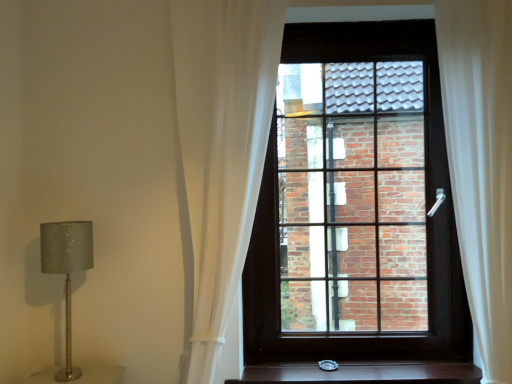
Describe the element at coordinates (222, 146) in the screenshot. I see `white sheer curtain at center, the 2th curtain in the right-to-left sequence` at that location.

The image size is (512, 384). What do you see at coordinates (481, 163) in the screenshot? I see `white sheer curtain at right, which is the 2th curtain from left to right` at bounding box center [481, 163].

Measure the distance between wooden stair treads at lower center and camera.

The distance of wooden stair treads at lower center from camera is 5.85 feet.

Where is `silver textured lamp at left`? silver textured lamp at left is located at coordinates (67, 270).

What do you see at coordinates (356, 204) in the screenshot?
I see `matte dark wood window at center` at bounding box center [356, 204].

Find the location of `white sheer curtain at center, the 2th curtain in the right-to-left sequence`. white sheer curtain at center, the 2th curtain in the right-to-left sequence is located at coordinates (222, 146).

From a real-world perspective, which is physically below, wooden stair treads at lower center or silver textured lamp at left?

From a 3D spatial view, wooden stair treads at lower center is below.

Can you confirm if wooden stair treads at lower center is smaller than silver textured lamp at left?

Yes, wooden stair treads at lower center is smaller than silver textured lamp at left.

Who is more distant, wooden stair treads at lower center or silver textured lamp at left?

wooden stair treads at lower center is further away from the camera.

Are wooden stair treads at lower center and matte dark wood window at center located far from each other?

No.

How many degrees apart are the facing directions of wooden stair treads at lower center and matte dark wood window at center?

The facing directions of wooden stair treads at lower center and matte dark wood window at center are 0.574 degrees apart.

Is wooden stair treads at lower center taller than matte dark wood window at center?

Answer: No.

From a real-world perspective, is wooden stair treads at lower center positioned over matte dark wood window at center based on gravity?

No, from a real-world perspective, wooden stair treads at lower center is not over matte dark wood window at center

Based on the photo, who is more distant, silver textured lamp at left or white sheer curtain at center, the 1th curtain when ordered from left to right?

white sheer curtain at center, the 1th curtain when ordered from left to right, is further away from the camera.

From a real-world perspective, is silver textured lamp at left on top of white sheer curtain at center, the 2th curtain in the right-to-left sequence?

No, from a real-world perspective, silver textured lamp at left is not above white sheer curtain at center, the 2th curtain in the right-to-left sequence.

Is point (75, 369) behind point (443, 257)?

That is False.

Are silver textured lamp at left and matte dark wood window at center beside each other?

They are not placed beside each other.

Does silver textured lamp at left have a larger size compared to matte dark wood window at center?

Actually, silver textured lamp at left might be smaller than matte dark wood window at center.

Based on the photo, in the image, is silver textured lamp at left positioned in front of or behind matte dark wood window at center?

Clearly, silver textured lamp at left is in front of matte dark wood window at center.

In the scene shown: From a real-world perspective, is white sheer curtain at center, the 1th curtain when ordered from left to right, physically located above or below wooden stair treads at lower center?

white sheer curtain at center, the 1th curtain when ordered from left to right, is above wooden stair treads at lower center.

Considering the positions of objects white sheer curtain at center, the 1th curtain when ordered from left to right, and wooden stair treads at lower center in the image provided, who is in front, white sheer curtain at center, the 1th curtain when ordered from left to right, or wooden stair treads at lower center?

white sheer curtain at center, the 1th curtain when ordered from left to right, is closer to the camera.

Looking at the image, does white sheer curtain at center, the 1th curtain when ordered from left to right, seem bigger or smaller compared to wooden stair treads at lower center?

Clearly, white sheer curtain at center, the 1th curtain when ordered from left to right, is larger in size than wooden stair treads at lower center.

How many degrees apart are the facing directions of white sheer curtain at center, the 2th curtain in the right-to-left sequence, and silver textured lamp at left?

The angular difference between white sheer curtain at center, the 2th curtain in the right-to-left sequence, and silver textured lamp at left is 89.1 degrees.

In the scene shown: Which point is more forward, (253, 39) or (50, 273)?

Point (253, 39)

Do you think white sheer curtain at center, the 1th curtain when ordered from left to right, is within silver textured lamp at left, or outside of it?

white sheer curtain at center, the 1th curtain when ordered from left to right, cannot be found inside silver textured lamp at left.

From the picture: Considering the relative positions of white sheer curtain at center, the 2th curtain in the right-to-left sequence, and silver textured lamp at left in the image provided, is white sheer curtain at center, the 2th curtain in the right-to-left sequence, to the left of silver textured lamp at left from the viewer's perspective?

No.

Does white sheer curtain at right, which is the 2th curtain from left to right, have a lesser width compared to wooden stair treads at lower center?

Result: Correct, the width of white sheer curtain at right, which is the 2th curtain from left to right, is less than that of wooden stair treads at lower center.

From a real-world perspective, count 1st curtains upward from the wooden stair treads at lower center and point to it. Please provide its 2D coordinates.

[(481, 163)]

Considering the relative sizes of white sheer curtain at right, which is the 2th curtain from left to right, and wooden stair treads at lower center in the image provided, is white sheer curtain at right, which is the 2th curtain from left to right, bigger than wooden stair treads at lower center?

Correct, white sheer curtain at right, which is the 2th curtain from left to right, is larger in size than wooden stair treads at lower center.

Is white sheer curtain at right, positioned as the first curtain in right-to-left order, oriented towards wooden stair treads at lower center?

No, white sheer curtain at right, positioned as the first curtain in right-to-left order, does not turn towards wooden stair treads at lower center.

This screenshot has width=512, height=384. I want to click on stairs below the silver textured lamp at left (from the image's perspective), so click(x=362, y=373).

Identify the location of stairs below the matte dark wood window at center (from a real-world perspective). (362, 373).

Looking at the image, which one is located further to white sheer curtain at center, the 1th curtain when ordered from left to right, white sheer curtain at right, positioned as the first curtain in right-to-left order, or wooden stair treads at lower center?

white sheer curtain at right, positioned as the first curtain in right-to-left order, lies further to white sheer curtain at center, the 1th curtain when ordered from left to right, than the other object.

Based on their spatial positions, is matte dark wood window at center or white sheer curtain at center, the 2th curtain in the right-to-left sequence, further from silver textured lamp at left?

matte dark wood window at center.

When comparing their distances from matte dark wood window at center, does white sheer curtain at right, positioned as the first curtain in right-to-left order, or white sheer curtain at center, the 2th curtain in the right-to-left sequence, seem closer?

Among the two, white sheer curtain at right, positioned as the first curtain in right-to-left order, is located nearer to matte dark wood window at center.

Considering their positions, is wooden stair treads at lower center positioned further to white sheer curtain at right, which is the 2th curtain from left to right, than white sheer curtain at center, the 2th curtain in the right-to-left sequence?

The object further to white sheer curtain at right, which is the 2th curtain from left to right, is white sheer curtain at center, the 2th curtain in the right-to-left sequence.

Based on their spatial positions, is white sheer curtain at center, the 2th curtain in the right-to-left sequence, or silver textured lamp at left closer to white sheer curtain at right, positioned as the first curtain in right-to-left order?

Based on the image, white sheer curtain at center, the 2th curtain in the right-to-left sequence, appears to be nearer to white sheer curtain at right, positioned as the first curtain in right-to-left order.

When comparing their distances from white sheer curtain at right, which is the 2th curtain from left to right, does white sheer curtain at center, the 1th curtain when ordered from left to right, or matte dark wood window at center seem closer?

matte dark wood window at center is positioned closer to the anchor white sheer curtain at right, which is the 2th curtain from left to right.

Considering their positions, is wooden stair treads at lower center positioned closer to silver textured lamp at left than white sheer curtain at right, which is the 2th curtain from left to right?

The object closer to silver textured lamp at left is wooden stair treads at lower center.

Which object lies further to the anchor point matte dark wood window at center, silver textured lamp at left or white sheer curtain at right, which is the 2th curtain from left to right?

silver textured lamp at left lies further to matte dark wood window at center than the other object.

You are a GUI agent. You are given a task and a screenshot of the screen. Output one action in this format:
    pyautogui.click(x=<x>, y=<y>)
    Task: Click on the window located between white sheer curtain at center, the 2th curtain in the right-to-left sequence, and white sheer curtain at right, positioned as the first curtain in right-to-left order, in the left-right direction
    
    Given the screenshot: What is the action you would take?
    pyautogui.click(x=356, y=204)

You are a GUI agent. You are given a task and a screenshot of the screen. Output one action in this format:
    pyautogui.click(x=<x>, y=<y>)
    Task: Click on the stairs between white sheer curtain at center, the 2th curtain in the right-to-left sequence, and white sheer curtain at right, which is the 2th curtain from left to right
    
    Given the screenshot: What is the action you would take?
    pyautogui.click(x=362, y=373)

Identify the location of curtain located between silver textured lamp at left and wooden stair treads at lower center in the left-right direction. (222, 146).

At what (x,y) coordinates should I click in order to perform the action: click on curtain located between silver textured lamp at left and matte dark wood window at center in the left-right direction. Please return your answer as a coordinate pair (x, y). This screenshot has width=512, height=384. Looking at the image, I should click on pyautogui.click(x=222, y=146).